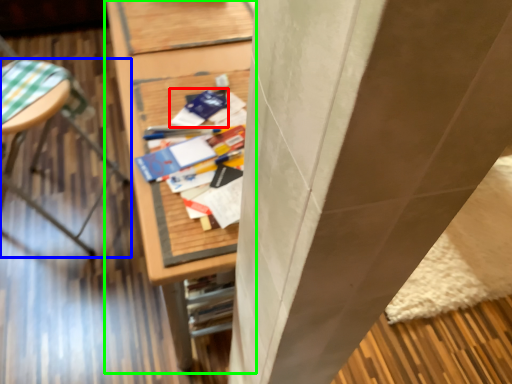
Question: Which object is the closest to the paperback book (highlighted by a red box)? Choose among these: furniture (highlighted by a blue box) or furniture (highlighted by a green box).

Choices:
 (A) furniture
 (B) furniture

Answer: (B)